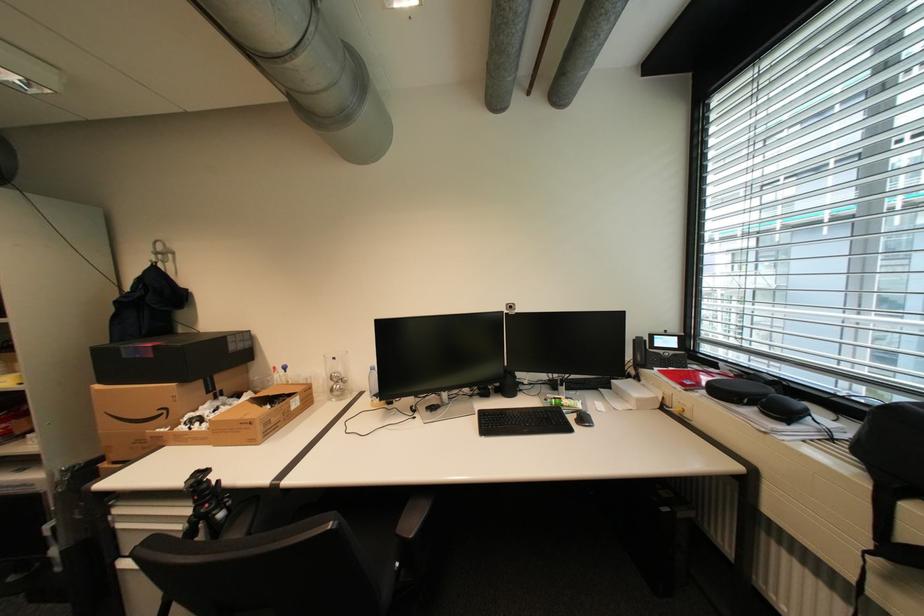
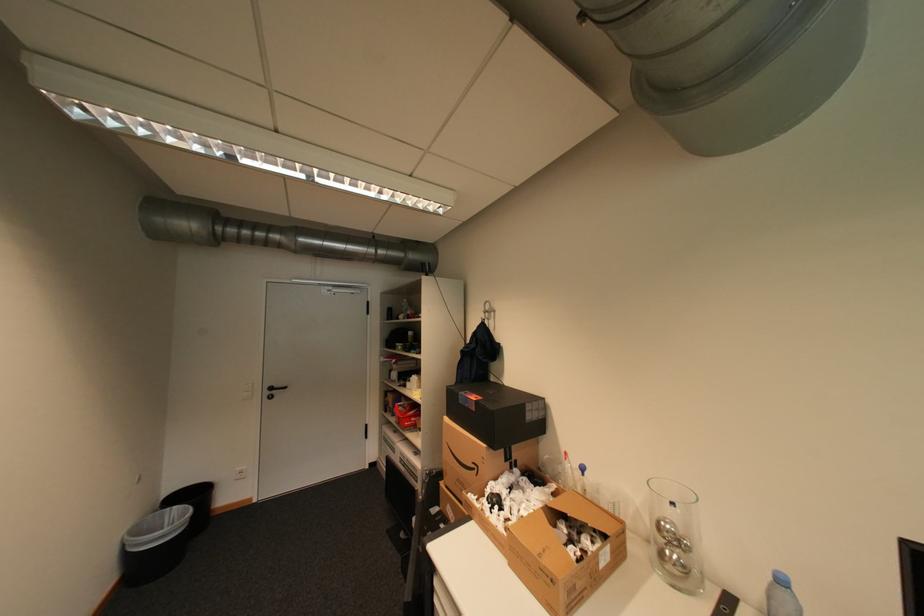
The point at (343, 376) is marked in the first image. Where is the corresponding point in the second image?

(673, 527)